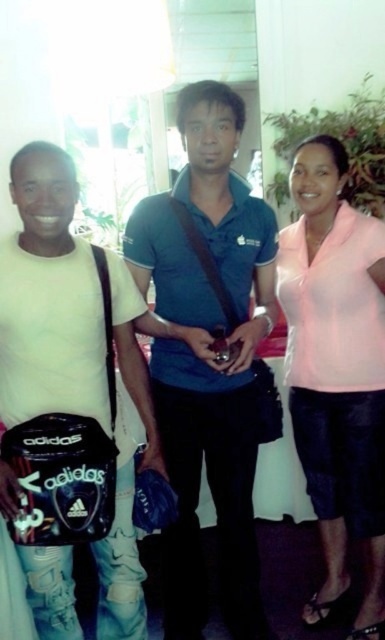
Which is more to the right, blue cotton polo shirt at center or pink matte shirt at right?

pink matte shirt at right is more to the right.

Does blue cotton polo shirt at center have a lesser width compared to pink matte shirt at right?

No, blue cotton polo shirt at center is not thinner than pink matte shirt at right.

Between point (271, 280) and point (376, 548), which one is positioned behind?

The point (376, 548) is more distant.

Identify the location of blue cotton polo shirt at center. The width and height of the screenshot is (385, 640). (204, 360).

Is the position of blue cotton polo shirt at center more distant than that of black matte adidas bag at left?

Yes, it is behind black matte adidas bag at left.

Between blue cotton polo shirt at center and black matte adidas bag at left, which one is positioned higher?

blue cotton polo shirt at center

This screenshot has width=385, height=640. Describe the element at coordinates (204, 360) in the screenshot. I see `blue cotton polo shirt at center` at that location.

The height and width of the screenshot is (640, 385). I want to click on blue cotton polo shirt at center, so click(x=204, y=360).

Does black matte adidas bag at left appear over pink matte shirt at right?

Incorrect, black matte adidas bag at left is not positioned above pink matte shirt at right.

Does point (110, 532) come closer to viewer compared to point (319, 474)?

Yes, point (110, 532) is closer to viewer.

Locate an element on the screen. black matte adidas bag at left is located at coordinates (48, 298).